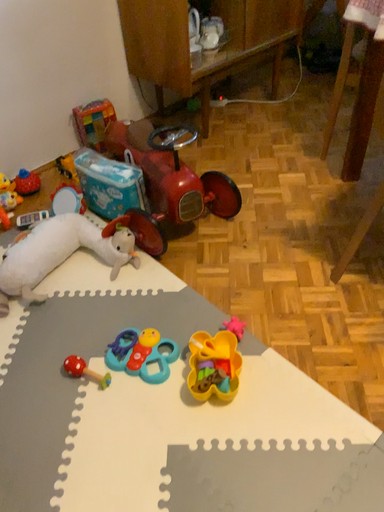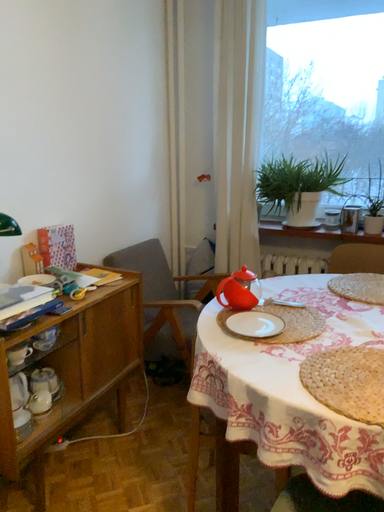
Question: How did the camera likely rotate when shooting the video?

Choices:
 (A) rotated right
 (B) rotated left

Answer: (A)